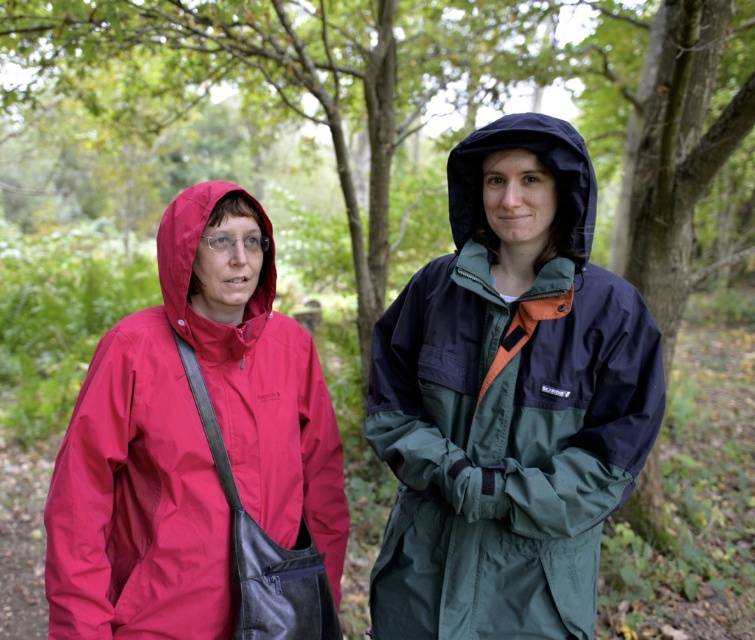
Based on the photo, is matte red jacket at left thinner than black matte hood at upper center?

No.

Image resolution: width=755 pixels, height=640 pixels. I want to click on matte red jacket at left, so click(507, 401).

Between point (122, 387) and point (584, 214), which one is positioned in front?

Positioned in front is point (584, 214).

You are a GUI agent. You are given a task and a screenshot of the screen. Output one action in this format:
    pyautogui.click(x=<x>, y=<y>)
    Task: Click on the matte red jacket at left
    
    Given the screenshot: What is the action you would take?
    pyautogui.click(x=507, y=401)

Can you confirm if green matte jacket at center is positioned above matte red hood at left?

Incorrect, green matte jacket at center is not positioned above matte red hood at left.

Is green matte jacket at center wider than matte red hood at left?

Correct, the width of green matte jacket at center exceeds that of matte red hood at left.

Who is more distant from viewer, (556, 262) or (185, 240)?

Positioned behind is point (185, 240).

What are the coordinates of `green matte jacket at center` in the screenshot? It's located at (507, 401).

Between matte red jacket at left and matte red hood at left, which one has less height?

With less height is matte red hood at left.

Which is more to the left, matte red jacket at left or matte red hood at left?

matte red hood at left

The height and width of the screenshot is (640, 755). What do you see at coordinates (507, 401) in the screenshot? I see `matte red jacket at left` at bounding box center [507, 401].

The image size is (755, 640). Find the location of `matte red jacket at left`. matte red jacket at left is located at coordinates coord(507,401).